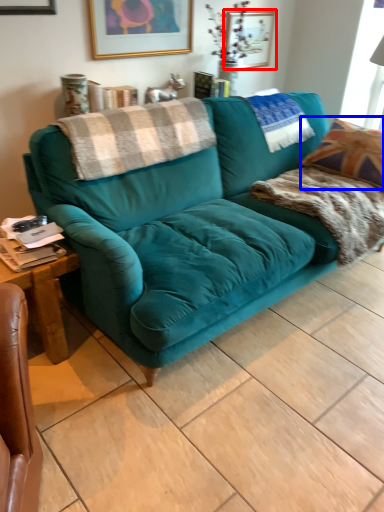
Question: Which object appears closest to the camera in this image, picture frame (highlighted by a red box) or throw pillow (highlighted by a blue box)?

Choices:
 (A) picture frame
 (B) throw pillow

Answer: (B)